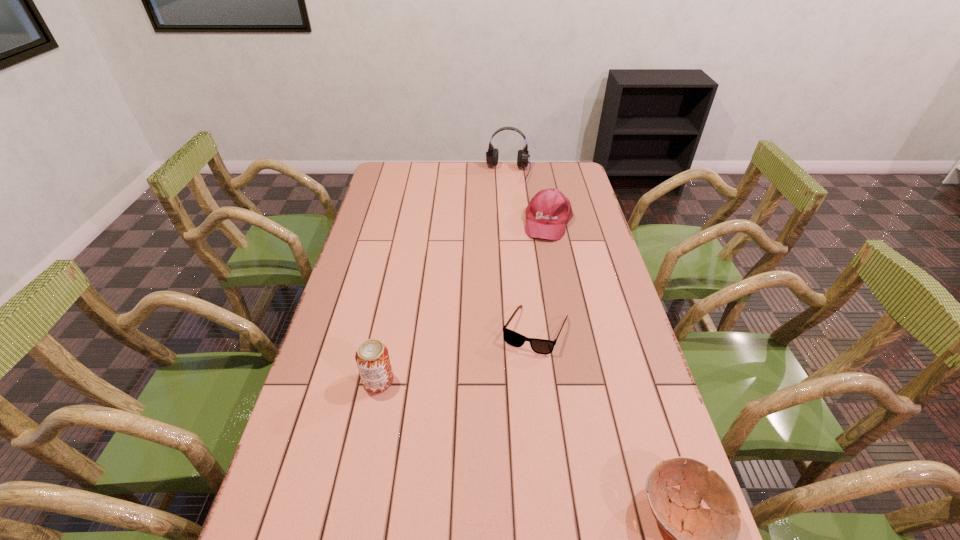
Locate an element on the screen. blank space located 0.060m at the front of the baseball cap with the brim is located at coordinates (543, 252).

Where is `vacant area located 0.310m on the front-facing side of the sunglasses`? vacant area located 0.310m on the front-facing side of the sunglasses is located at coordinates (490, 457).

Locate an element on the screen. The width and height of the screenshot is (960, 540). free region located on the front-facing side of the sunglasses is located at coordinates pos(516,384).

Locate an element on the screen. vacant space situated on the front-facing side of the sunglasses is located at coordinates (516, 384).

Locate an element on the screen. The height and width of the screenshot is (540, 960). vacant space located on the ear cushions of the headset is located at coordinates (505, 199).

The height and width of the screenshot is (540, 960). I want to click on free space located on the ear cushions of the headset, so click(505, 199).

I want to click on free space located 0.400m on the ear cushions of the headset, so click(499, 240).

The height and width of the screenshot is (540, 960). Find the location of `object present at the far edge`. object present at the far edge is located at coordinates (492, 154).

Identify the location of object that is at the left edge. (372, 357).

This screenshot has height=540, width=960. What are the coordinates of `object at the right edge` in the screenshot? It's located at (548, 212).